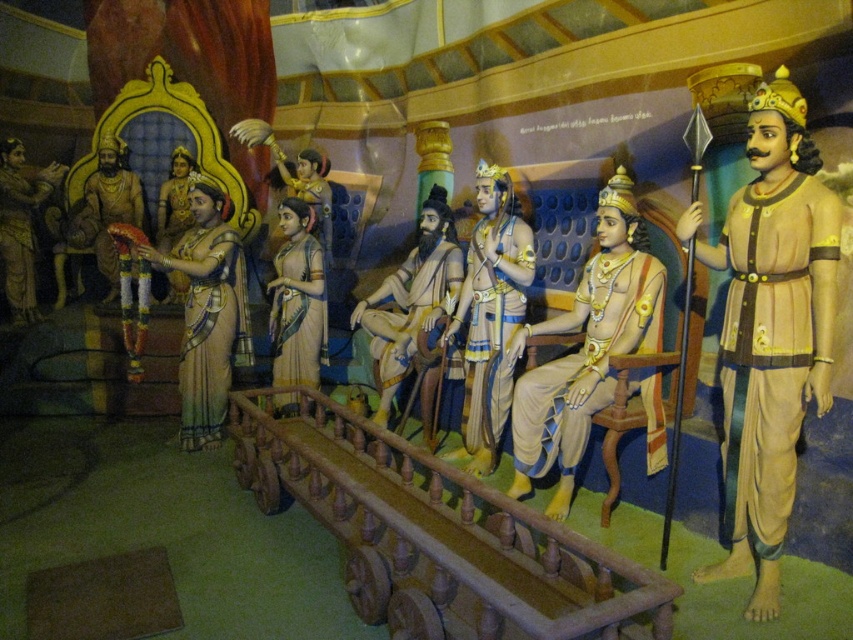
Between smooth beige robe at center and matte gold crown at center, which one has more height?

Standing taller between the two is smooth beige robe at center.

Find the location of a particular element. This screenshot has height=640, width=853. smooth beige robe at center is located at coordinates (415, 312).

Identify the location of smooth beige robe at center. Image resolution: width=853 pixels, height=640 pixels. coord(415,312).

Does smooth gold armor at center appear under matte gold statue at left?

Indeed, smooth gold armor at center is positioned under matte gold statue at left.

The image size is (853, 640). Identify the location of smooth gold armor at center. (491, 310).

This screenshot has height=640, width=853. What are the coordinates of `smooth gold armor at center` in the screenshot? It's located at (491, 310).

Does matte gold sari at center come in front of matte gold crown at left?

Yes, it is.

Is point (291, 396) positioned in front of point (28, 208)?

Yes, it is.

Between point (305, 202) and point (1, 220), which one is positioned behind?

The point (1, 220) is more distant.

Where is `matte gold sari at center`? matte gold sari at center is located at coordinates (297, 300).